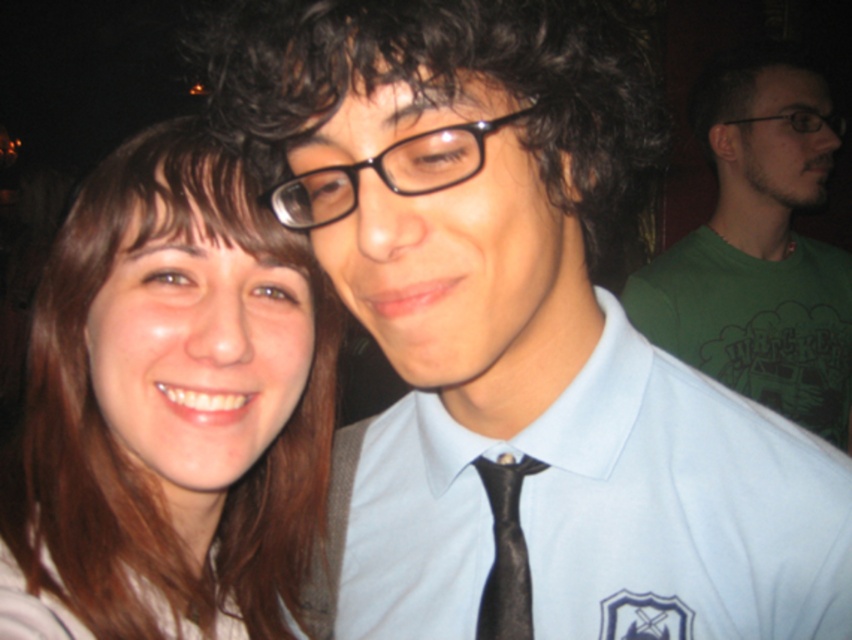
Question: From the image, what is the correct spatial relationship of light blue smooth dress shirt at center in relation to black silk tie at center?

Choices:
 (A) right
 (B) left

Answer: (A)

Question: Based on their relative distances, which object is nearer to the dark curly hair at center?

Choices:
 (A) black plastic glasses at upper right
 (B) brown hair at upper left

Answer: (B)

Question: Is brown hair at upper left closer to the viewer compared to black silk tie at center?

Choices:
 (A) yes
 (B) no

Answer: (A)

Question: Is dark curly hair at center below green cotton t-shirt at upper right?

Choices:
 (A) yes
 (B) no

Answer: (A)

Question: Estimate the real-world distances between objects in this image. Which object is closer to the dark curly hair at center?

Choices:
 (A) black plastic glasses at center
 (B) black plastic glasses at upper right
 (C) green cotton t-shirt at upper right
 (D) black silk tie at center

Answer: (A)

Question: Among these objects, which one is nearest to the camera?

Choices:
 (A) black silk tie at center
 (B) green cotton t-shirt at upper right
 (C) black plastic glasses at center

Answer: (C)